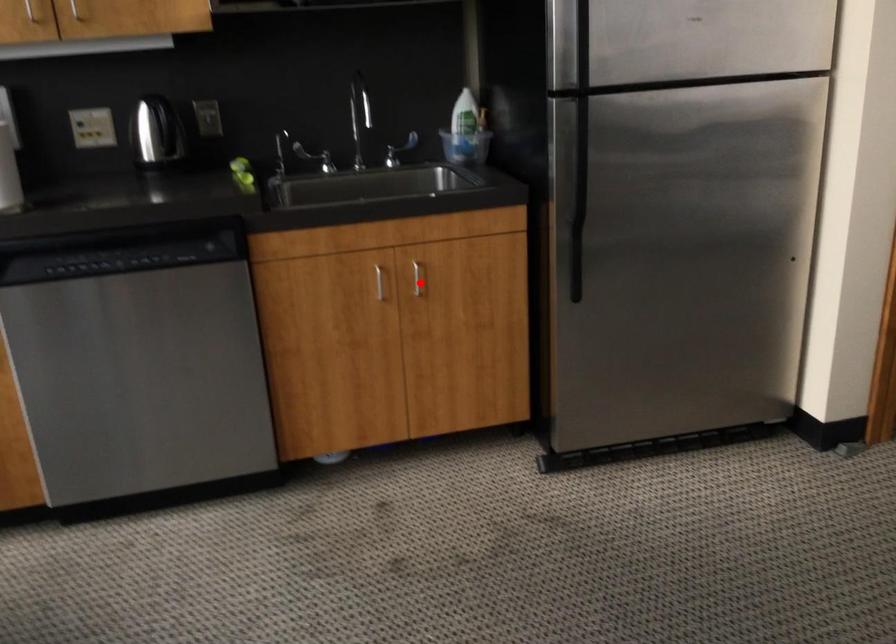
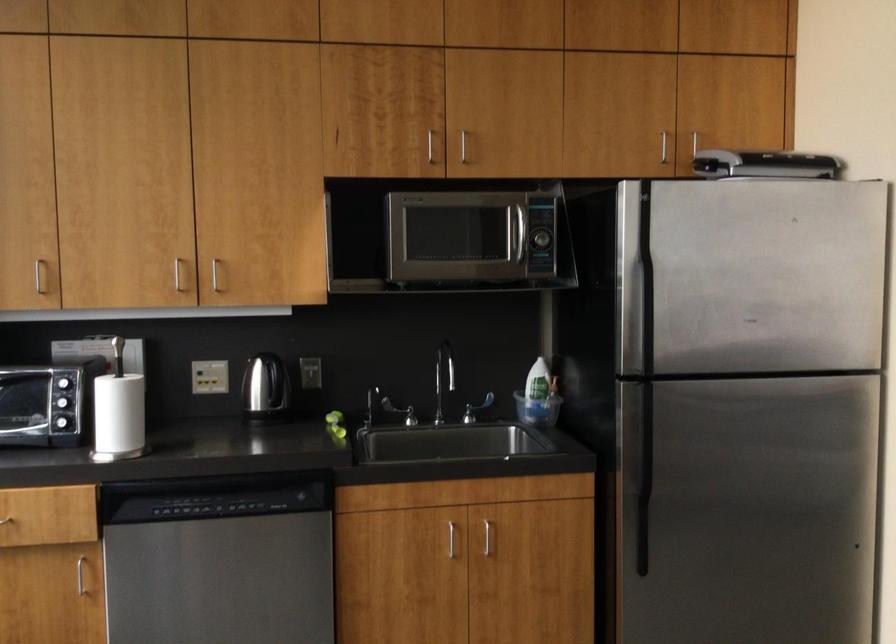
The point at the highlighted location is marked in the first image. Where is the corresponding point in the second image?

(490, 542)